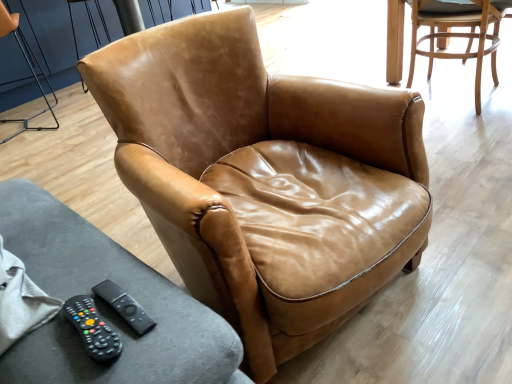
Measure the distance between black rubber remote at lower left, which is the first remote from front to back, and camera.

The depth of black rubber remote at lower left, which is the first remote from front to back, is 25.03 inches.

The image size is (512, 384). I want to click on black rubber remote at lower left, the 2th remote viewed from the back, so click(92, 328).

Locate an element on the screen. This screenshot has width=512, height=384. cognac leather armchair at center, which ranks as the 2th chair in right-to-left order is located at coordinates (247, 166).

What do you see at coordinates (29, 68) in the screenshot? I see `brown leather armchair at upper center, which appears as the 3th chair when viewed from the right` at bounding box center [29, 68].

Where is `black rubber remote at lower left, the 2th remote viewed from the back`? This screenshot has height=384, width=512. black rubber remote at lower left, the 2th remote viewed from the back is located at coordinates (92, 328).

Considering the relative positions of light brown leather chair at upper right, positioned as the 3th chair in left-to-right order, and black rubber remote at lower left, the 2th remote viewed from the back, in the image provided, is light brown leather chair at upper right, positioned as the 3th chair in left-to-right order, to the left of black rubber remote at lower left, the 2th remote viewed from the back, from the viewer's perspective?

No, light brown leather chair at upper right, positioned as the 3th chair in left-to-right order, is not to the left of black rubber remote at lower left, the 2th remote viewed from the back.

Is light brown leather chair at upper right, which is the 1th chair in right-to-left order, shorter than black rubber remote at lower left, the 2th remote viewed from the back?

Incorrect, the height of light brown leather chair at upper right, which is the 1th chair in right-to-left order, does not fall short of that of black rubber remote at lower left, the 2th remote viewed from the back.

From a real-world perspective, between light brown leather chair at upper right, which is the 1th chair in right-to-left order, and black rubber remote at lower left, which is the first remote from front to back, who is vertically higher?

black rubber remote at lower left, which is the first remote from front to back, from a real-world perspective.

Is black rubber remote at lower left, which is the first remote from front to back, smaller than cognac leather armchair at center, which ranks as the 2th chair in right-to-left order?

Correct, black rubber remote at lower left, which is the first remote from front to back, occupies less space than cognac leather armchair at center, which ranks as the 2th chair in right-to-left order.

Does black rubber remote at lower left, the 2th remote viewed from the back, have a greater width compared to cognac leather armchair at center, the second chair viewed from the left?

No, black rubber remote at lower left, the 2th remote viewed from the back, is not wider than cognac leather armchair at center, the second chair viewed from the left.

What's the angular difference between black rubber remote at lower left, which is the first remote from front to back, and cognac leather armchair at center, which ranks as the 2th chair in right-to-left order,'s facing directions?

10.3 degrees separate the facing orientations of black rubber remote at lower left, which is the first remote from front to back, and cognac leather armchair at center, which ranks as the 2th chair in right-to-left order.

Is cognac leather armchair at center, which ranks as the 2th chair in right-to-left order, directly adjacent to black rubber remote at lower left, the second remote in the front-to-back sequence?

No, cognac leather armchair at center, which ranks as the 2th chair in right-to-left order, is not touching black rubber remote at lower left, the second remote in the front-to-back sequence.

In terms of height, does cognac leather armchair at center, the second chair viewed from the left, look taller or shorter compared to black rubber remote at lower left, placed as the first remote when sorted from back to front?

Considering their sizes, cognac leather armchair at center, the second chair viewed from the left, has more height than black rubber remote at lower left, placed as the first remote when sorted from back to front.

Is cognac leather armchair at center, the second chair viewed from the left, to the left of black rubber remote at lower left, placed as the first remote when sorted from back to front, from the viewer's perspective?

No.

Which object is closer to the camera, cognac leather armchair at center, the second chair viewed from the left, or black rubber remote at lower left, the second remote in the front-to-back sequence?

cognac leather armchair at center, the second chair viewed from the left, is in front.

From the image's perspective, who appears lower, black rubber remote at lower left, placed as the first remote when sorted from back to front, or brown leather armchair at upper center, which appears as the 3th chair when viewed from the right?

From the image's view, black rubber remote at lower left, placed as the first remote when sorted from back to front, is below.

Considering the sizes of black rubber remote at lower left, the second remote in the front-to-back sequence, and brown leather armchair at upper center, which appears as the 3th chair when viewed from the right, in the image, is black rubber remote at lower left, the second remote in the front-to-back sequence, bigger or smaller than brown leather armchair at upper center, which appears as the 3th chair when viewed from the right,?

In the image, black rubber remote at lower left, the second remote in the front-to-back sequence, appears to be smaller than brown leather armchair at upper center, which appears as the 3th chair when viewed from the right.

Is black rubber remote at lower left, the second remote in the front-to-back sequence, next to brown leather armchair at upper center, which is counted as the 1th chair, starting from the left?

There is a gap between black rubber remote at lower left, the second remote in the front-to-back sequence, and brown leather armchair at upper center, which is counted as the 1th chair, starting from the left.

Do you think black rubber remote at lower left, placed as the first remote when sorted from back to front, is within brown leather armchair at upper center, which appears as the 3th chair when viewed from the right, or outside of it?

black rubber remote at lower left, placed as the first remote when sorted from back to front, lies outside brown leather armchair at upper center, which appears as the 3th chair when viewed from the right.

Relative to black rubber remote at lower left, the second remote in the front-to-back sequence, is brown leather armchair at upper center, which is counted as the 1th chair, starting from the left, in front or behind?

Clearly, brown leather armchair at upper center, which is counted as the 1th chair, starting from the left, is behind black rubber remote at lower left, the second remote in the front-to-back sequence.

Considering the relative sizes of brown leather armchair at upper center, which is counted as the 1th chair, starting from the left, and black rubber remote at lower left, the second remote in the front-to-back sequence, in the image provided, is brown leather armchair at upper center, which is counted as the 1th chair, starting from the left, bigger than black rubber remote at lower left, the second remote in the front-to-back sequence,?

Yes.

Considering the relative sizes of brown leather armchair at upper center, which is counted as the 1th chair, starting from the left, and black rubber remote at lower left, placed as the first remote when sorted from back to front, in the image provided, is brown leather armchair at upper center, which is counted as the 1th chair, starting from the left, shorter than black rubber remote at lower left, placed as the first remote when sorted from back to front,?

In fact, brown leather armchair at upper center, which is counted as the 1th chair, starting from the left, may be taller than black rubber remote at lower left, placed as the first remote when sorted from back to front.

From the picture: Can you see brown leather armchair at upper center, which appears as the 3th chair when viewed from the right, touching black rubber remote at lower left, placed as the first remote when sorted from back to front?

No, brown leather armchair at upper center, which appears as the 3th chair when viewed from the right, is not making contact with black rubber remote at lower left, placed as the first remote when sorted from back to front.

Which object is more forward, black rubber remote at lower left, the second remote in the front-to-back sequence, or black rubber remote at lower left, which is the first remote from front to back?

black rubber remote at lower left, which is the first remote from front to back, is more forward.

In terms of width, does black rubber remote at lower left, placed as the first remote when sorted from back to front, look wider or thinner when compared to black rubber remote at lower left, which is the first remote from front to back?

black rubber remote at lower left, placed as the first remote when sorted from back to front, is thinner than black rubber remote at lower left, which is the first remote from front to back.

What's the angular difference between black rubber remote at lower left, the second remote in the front-to-back sequence, and black rubber remote at lower left, the 2th remote viewed from the back,'s facing directions?

The facing directions of black rubber remote at lower left, the second remote in the front-to-back sequence, and black rubber remote at lower left, the 2th remote viewed from the back, are 0.00194 degrees apart.

Does point (493, 72) come in front of point (144, 325)?

That is False.

Considering the relative sizes of light brown leather chair at upper right, positioned as the 3th chair in left-to-right order, and black rubber remote at lower left, the second remote in the front-to-back sequence, in the image provided, is light brown leather chair at upper right, positioned as the 3th chair in left-to-right order, thinner than black rubber remote at lower left, the second remote in the front-to-back sequence,?

In fact, light brown leather chair at upper right, positioned as the 3th chair in left-to-right order, might be wider than black rubber remote at lower left, the second remote in the front-to-back sequence.

Measure the distance between light brown leather chair at upper right, which is the 1th chair in right-to-left order, and black rubber remote at lower left, placed as the first remote when sorted from back to front.

light brown leather chair at upper right, which is the 1th chair in right-to-left order, and black rubber remote at lower left, placed as the first remote when sorted from back to front, are 2.15 meters apart from each other.

Can you confirm if light brown leather chair at upper right, positioned as the 3th chair in left-to-right order, is positioned to the left of black rubber remote at lower left, the second remote in the front-to-back sequence?

Incorrect, light brown leather chair at upper right, positioned as the 3th chair in left-to-right order, is not on the left side of black rubber remote at lower left, the second remote in the front-to-back sequence.

Where is `the 1st chair behind the black rubber remote at lower left, which is the first remote from front to back, starting your count from the anchor`? This screenshot has width=512, height=384. the 1st chair behind the black rubber remote at lower left, which is the first remote from front to back, starting your count from the anchor is located at coordinates (457, 37).

Starting from the cognac leather armchair at center, the second chair viewed from the left, which remote is the 2nd one to the left? Please provide its 2D coordinates.

[(92, 328)]

Which object lies nearer to the anchor point cognac leather armchair at center, which ranks as the 2th chair in right-to-left order, black rubber remote at lower left, the 2th remote viewed from the back, or black rubber remote at lower left, the second remote in the front-to-back sequence?

black rubber remote at lower left, the second remote in the front-to-back sequence, is positioned closer to the anchor cognac leather armchair at center, which ranks as the 2th chair in right-to-left order.

Considering their positions, is light brown leather chair at upper right, positioned as the 3th chair in left-to-right order, positioned further to black rubber remote at lower left, placed as the first remote when sorted from back to front, than black rubber remote at lower left, the 2th remote viewed from the back?

The object further to black rubber remote at lower left, placed as the first remote when sorted from back to front, is light brown leather chair at upper right, positioned as the 3th chair in left-to-right order.

When comparing their distances from brown leather armchair at upper center, which appears as the 3th chair when viewed from the right, does black rubber remote at lower left, the 2th remote viewed from the back, or light brown leather chair at upper right, positioned as the 3th chair in left-to-right order, seem further?

Among the two, black rubber remote at lower left, the 2th remote viewed from the back, is located further to brown leather armchair at upper center, which appears as the 3th chair when viewed from the right.

When comparing their distances from light brown leather chair at upper right, which is the 1th chair in right-to-left order, does cognac leather armchair at center, the second chair viewed from the left, or black rubber remote at lower left, the 2th remote viewed from the back, seem closer?

Based on the image, cognac leather armchair at center, the second chair viewed from the left, appears to be nearer to light brown leather chair at upper right, which is the 1th chair in right-to-left order.

When comparing their distances from brown leather armchair at upper center, which is counted as the 1th chair, starting from the left, does light brown leather chair at upper right, which is the 1th chair in right-to-left order, or black rubber remote at lower left, the second remote in the front-to-back sequence, seem further?

Among the two, black rubber remote at lower left, the second remote in the front-to-back sequence, is located further to brown leather armchair at upper center, which is counted as the 1th chair, starting from the left.

In the scene shown: When comparing their distances from brown leather armchair at upper center, which appears as the 3th chair when viewed from the right, does black rubber remote at lower left, which is the first remote from front to back, or cognac leather armchair at center, the second chair viewed from the left, seem further?

black rubber remote at lower left, which is the first remote from front to back, is positioned further to the anchor brown leather armchair at upper center, which appears as the 3th chair when viewed from the right.

Looking at the image, which one is located closer to brown leather armchair at upper center, which appears as the 3th chair when viewed from the right, black rubber remote at lower left, the second remote in the front-to-back sequence, or black rubber remote at lower left, which is the first remote from front to back?

black rubber remote at lower left, which is the first remote from front to back, is closer to brown leather armchair at upper center, which appears as the 3th chair when viewed from the right.

Which object lies further to the anchor point light brown leather chair at upper right, which is the 1th chair in right-to-left order, cognac leather armchair at center, which ranks as the 2th chair in right-to-left order, or black rubber remote at lower left, the second remote in the front-to-back sequence?

black rubber remote at lower left, the second remote in the front-to-back sequence, is further to light brown leather chair at upper right, which is the 1th chair in right-to-left order.

Image resolution: width=512 pixels, height=384 pixels. What are the coordinates of `remote between black rubber remote at lower left, the 2th remote viewed from the back, and cognac leather armchair at center, which ranks as the 2th chair in right-to-left order, in the horizontal direction` in the screenshot? It's located at (125, 306).

What are the coordinates of `remote between black rubber remote at lower left, which is the first remote from front to back, and light brown leather chair at upper right, positioned as the 3th chair in left-to-right order, from left to right` in the screenshot? It's located at (125, 306).

Where is `chair between brown leather armchair at upper center, which appears as the 3th chair when viewed from the right, and light brown leather chair at upper right, which is the 1th chair in right-to-left order, in the horizontal direction`? Image resolution: width=512 pixels, height=384 pixels. chair between brown leather armchair at upper center, which appears as the 3th chair when viewed from the right, and light brown leather chair at upper right, which is the 1th chair in right-to-left order, in the horizontal direction is located at coordinates [x=247, y=166].

This screenshot has height=384, width=512. In order to click on chair between black rubber remote at lower left, which is the first remote from front to back, and light brown leather chair at upper right, positioned as the 3th chair in left-to-right order in this screenshot , I will do `click(247, 166)`.